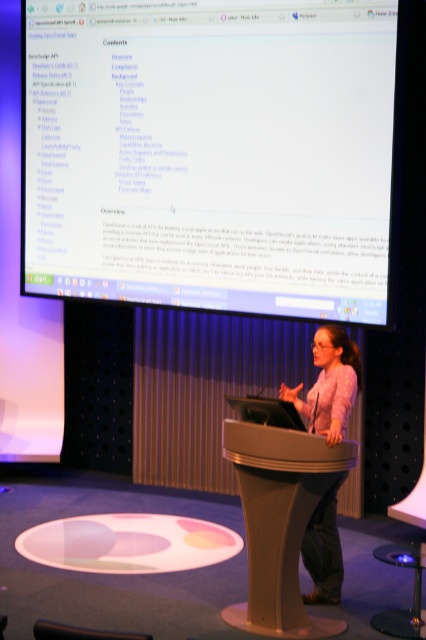
You are an event organizer setting up a presentation. You need to ensure that the white glossy projection screen at upper center and the pink fabric at center are positioned correctly. According to the description, which object is closer to the audience?

The white glossy projection screen at upper center is closer to the audience because it is further to the viewer than the pink fabric at center.

You are setting up a camera to film the presentation. The camera is placed at the front of the stage, and you need to ensure that the white glossy projection screen at upper center is fully visible in the frame. Given that the camera has a standard field of view, can you confirm if the screen is positioned within the camera frame?

The white glossy projection screen at upper center is located at point coordinates, so it should be within the camera frame if the camera is positioned at the front of the stage with a standard field of view. However, precise positioning may depend on the exact camera angle and zoom settings.

From the picture: You are a speaker who needs to adjust your position to ensure you are exactly 3 meters away from the matte gray podium at center during your presentation. Based on the current setup, should you move closer or farther away from the podium?

The distance between the matte gray podium at center and the viewer is currently 4.04 meters. To reach exactly 3 meters, you need to move closer to the podium by 1.04 meters.